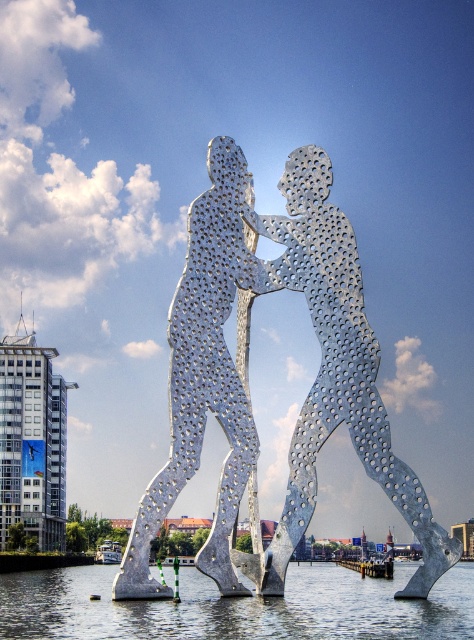
Question: Which is farther from the metallic silver sculpture at center?

Choices:
 (A) clear water at lower center
 (B) metallic perforated human figure at center

Answer: (A)

Question: Is metallic perforated human figure at center further to camera compared to clear water at lower center?

Choices:
 (A) yes
 (B) no

Answer: (A)

Question: Can you confirm if metallic perforated human figure at center is positioned above clear water at lower center?

Choices:
 (A) yes
 (B) no

Answer: (A)

Question: Which object is the closest to the metallic silver sculpture at center?

Choices:
 (A) metallic perforated human figure at center
 (B) clear water at lower center

Answer: (A)

Question: Considering the relative positions of metallic perforated human figure at center and metallic silver sculpture at center in the image provided, where is metallic perforated human figure at center located with respect to metallic silver sculpture at center?

Choices:
 (A) below
 (B) above

Answer: (A)

Question: Among these points, which one is farthest from the camera?

Choices:
 (A) (170, 461)
 (B) (425, 595)
 (C) (118, 624)

Answer: (B)